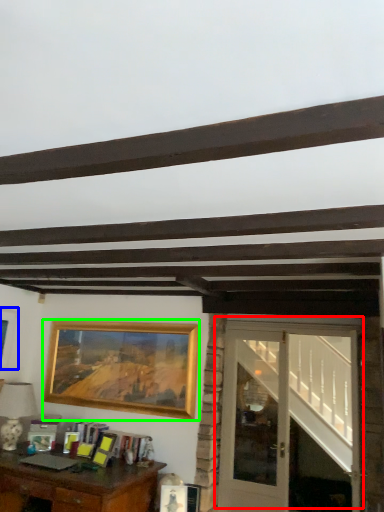
Question: Estimate the real-world distances between objects in this image. Which object is farther from door (highlighted by a red box), picture frame (highlighted by a blue box) or picture frame (highlighted by a green box)?

Choices:
 (A) picture frame
 (B) picture frame

Answer: (A)